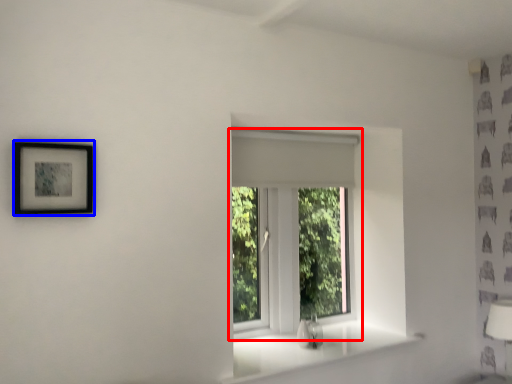
Question: Which of the following is the closest to the observer, window (highlighted by a red box) or picture frame (highlighted by a blue box)?

Choices:
 (A) window
 (B) picture frame

Answer: (B)